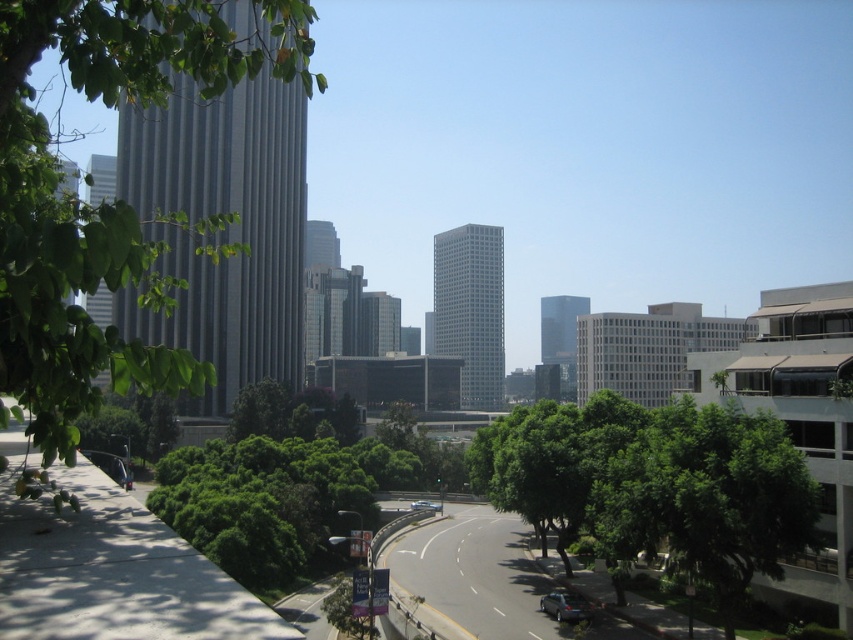
Question: Is the position of green leafy tree at center more distant than that of blue metallic car at center?

Choices:
 (A) no
 (B) yes

Answer: (A)

Question: Is green leafy tree at center bigger than blue metallic car at center?

Choices:
 (A) yes
 (B) no

Answer: (A)

Question: Estimate the real-world distances between objects in this image. Which object is farther from the shiny silver sedan at lower center?

Choices:
 (A) blue metallic car at center
 (B) green leafy tree at center

Answer: (A)

Question: In this image, where is green leafy tree at center located relative to blue metallic car at center?

Choices:
 (A) below
 (B) above

Answer: (B)

Question: Which point is farther from the camera taking this photo?

Choices:
 (A) (566, 595)
 (B) (428, 506)

Answer: (B)

Question: Considering the real-world distances, which object is closest to the green leafy tree at center?

Choices:
 (A) blue metallic car at center
 (B) green leafy tree at left

Answer: (B)